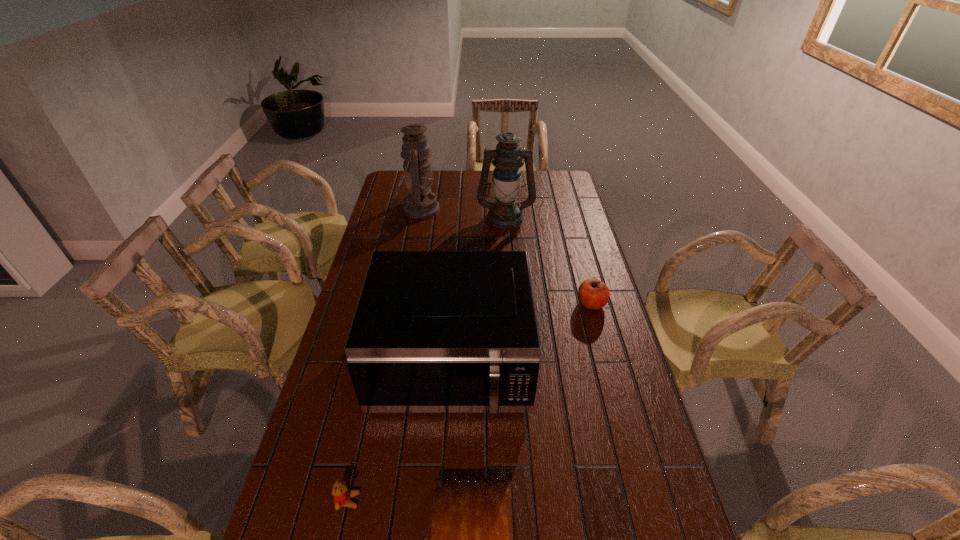
At what (x,y) coordinates should I click in order to perform the action: click on vacant space at the far right corner. Please return your answer as a coordinate pair (x, y). Looking at the image, I should click on (552, 171).

You are a GUI agent. You are given a task and a screenshot of the screen. Output one action in this format:
    pyautogui.click(x=<x>, y=<y>)
    Task: Click on the vacant point located between the fourth nearest object and the right oil lamp
    
    Given the screenshot: What is the action you would take?
    pyautogui.click(x=548, y=260)

The image size is (960, 540). In order to click on object identified as the fourth closest to the right oil lamp in this screenshot , I will do `click(471, 539)`.

Identify the location of object that is the fifth closest to the left oil lamp. This screenshot has width=960, height=540. (471, 539).